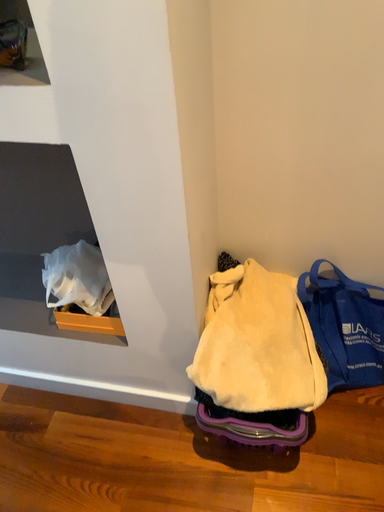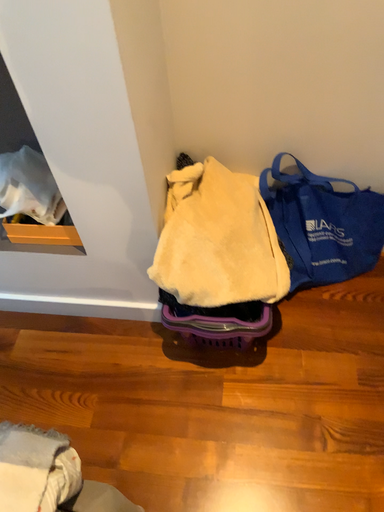
Question: Which way did the camera rotate in the video?

Choices:
 (A) rotated downward
 (B) rotated upward

Answer: (A)